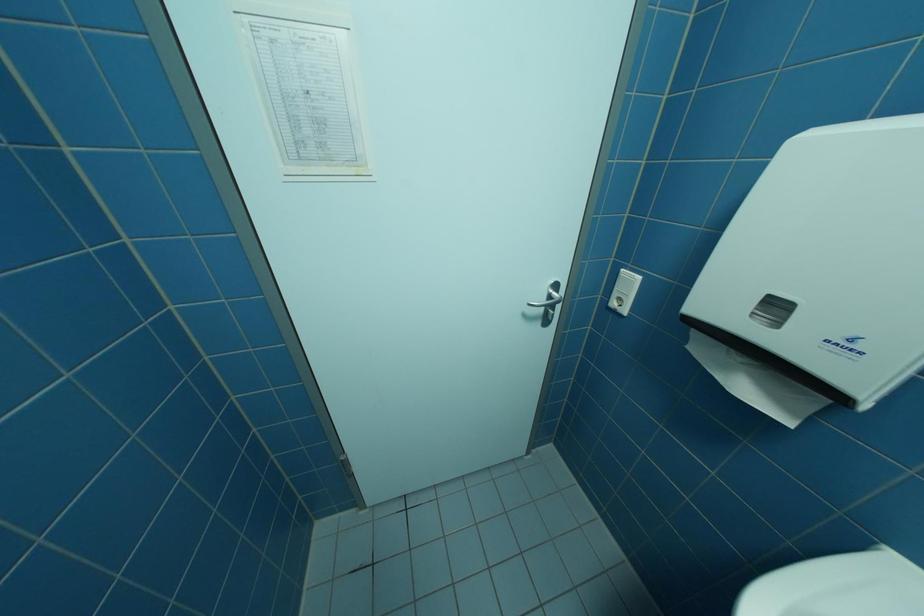
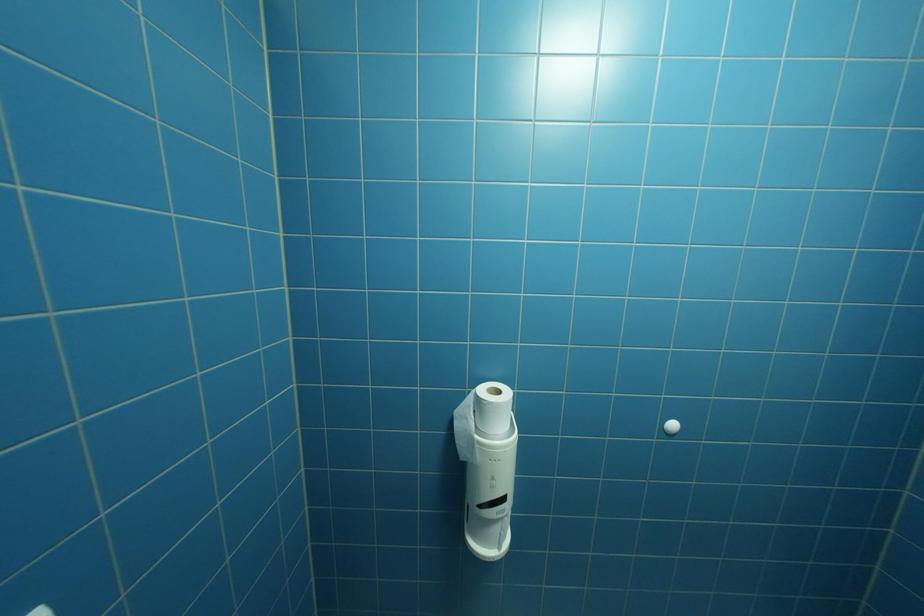
Based on the continuous images, in which direction is the camera rotating?

The camera rotated toward left-down.